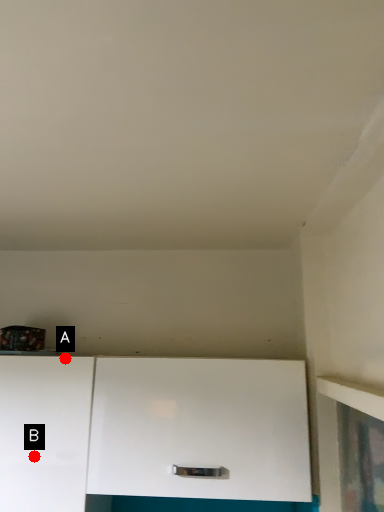
Question: Two points are circled on the image, labeled by A and B beside each circle. Which point is farther from the camera taking this photo?

Choices:
 (A) A is further
 (B) B is further

Answer: (A)